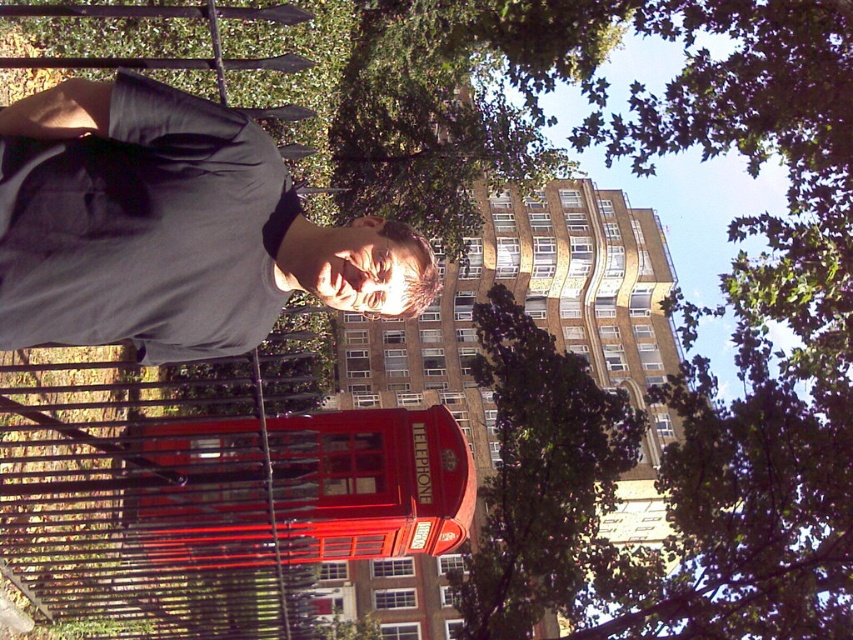
Who is more forward, (151, 164) or (573, 509)?

Point (151, 164) is in front.

Is point (233, 195) in front of point (496, 342)?

Yes, point (233, 195) is closer to viewer.

The height and width of the screenshot is (640, 853). I want to click on matte gray t-shirt at upper left, so click(175, 232).